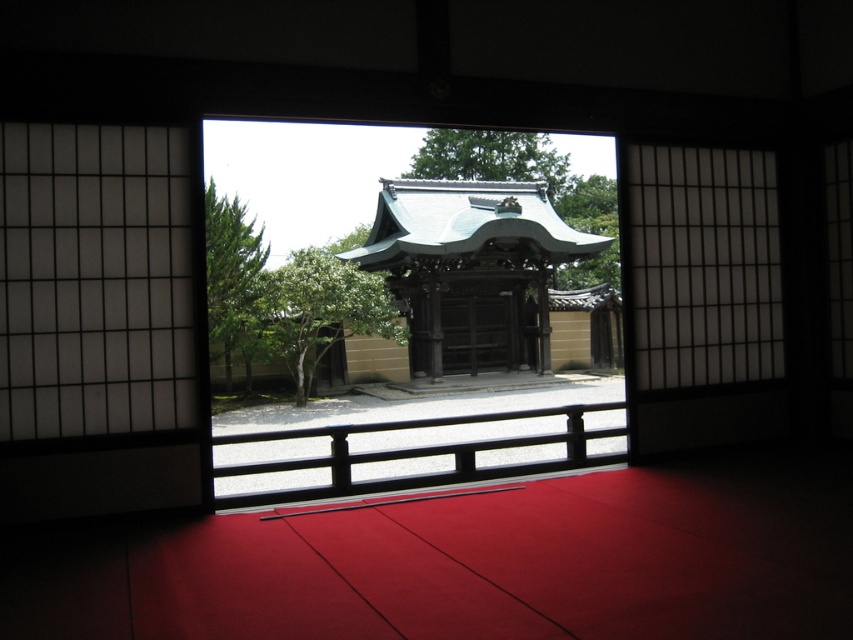
Question: Among these objects, which one is nearest to the camera?

Choices:
 (A) transparent glass window at center
 (B) wooden at center

Answer: (A)

Question: Is transparent glass window at center positioned before wooden at center?

Choices:
 (A) no
 (B) yes

Answer: (B)

Question: Which point is closer to the camera?

Choices:
 (A) transparent glass window at center
 (B) wooden at center

Answer: (A)

Question: Is transparent glass window at center to the left of wooden at center from the viewer's perspective?

Choices:
 (A) yes
 (B) no

Answer: (A)

Question: Does transparent glass window at center have a lesser width compared to wooden at center?

Choices:
 (A) no
 (B) yes

Answer: (A)